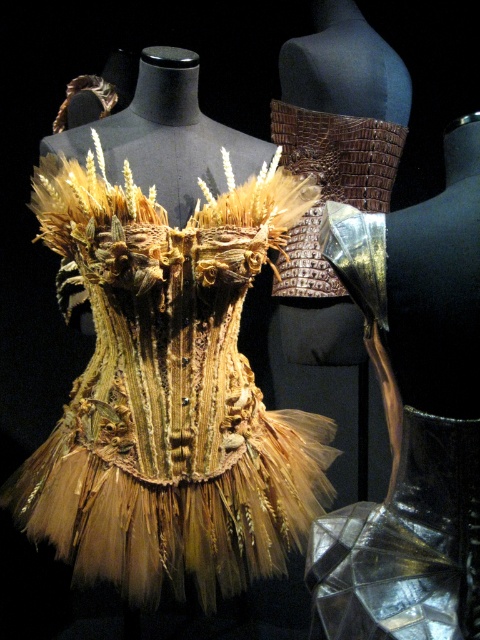
Question: Is leather-like brown corset at center bigger than translucent tulle skirt at center?

Choices:
 (A) no
 (B) yes

Answer: (B)

Question: Which of the following is the farthest from the observer?

Choices:
 (A) translucent tulle skirt at center
 (B) braided straw dress at center

Answer: (B)

Question: Is braided straw dress at center below translucent tulle skirt at center?

Choices:
 (A) no
 (B) yes

Answer: (A)

Question: Does braided straw dress at center have a greater width compared to translucent tulle skirt at center?

Choices:
 (A) yes
 (B) no

Answer: (A)

Question: Which point is farther to the camera?

Choices:
 (A) (201, 593)
 (B) (466, 472)

Answer: (A)

Question: Which point is closer to the camera?

Choices:
 (A) braided straw dress at center
 (B) leather-like brown corset at center
 (C) translucent tulle skirt at center

Answer: (C)